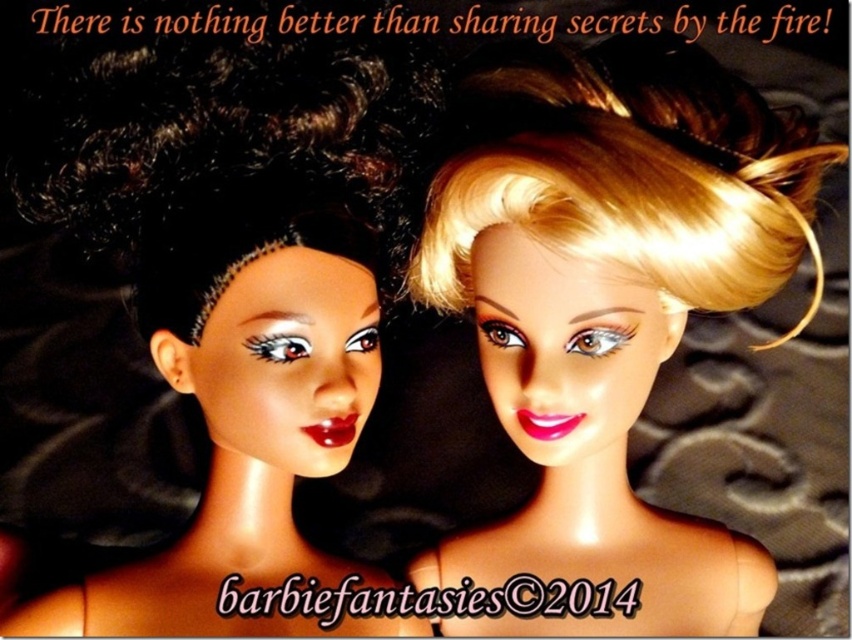
Who is lower down, shiny blonde hair at center or matte black doll at left?

matte black doll at left is below.

Find the location of a particular element. This screenshot has height=640, width=852. shiny blonde hair at center is located at coordinates (608, 301).

Where is `shiny blonde hair at center`? The width and height of the screenshot is (852, 640). shiny blonde hair at center is located at coordinates (608, 301).